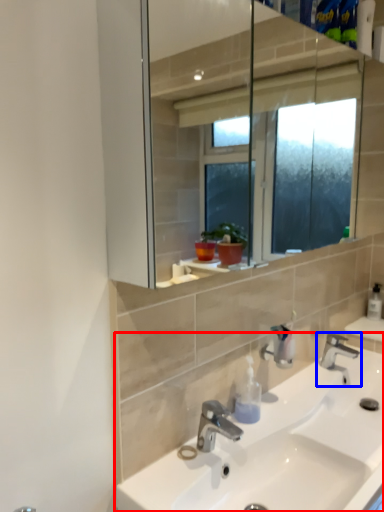
Question: Which of the following is the closest to the observer, sink (highlighted by a red box) or tap (highlighted by a blue box)?

Choices:
 (A) sink
 (B) tap

Answer: (A)